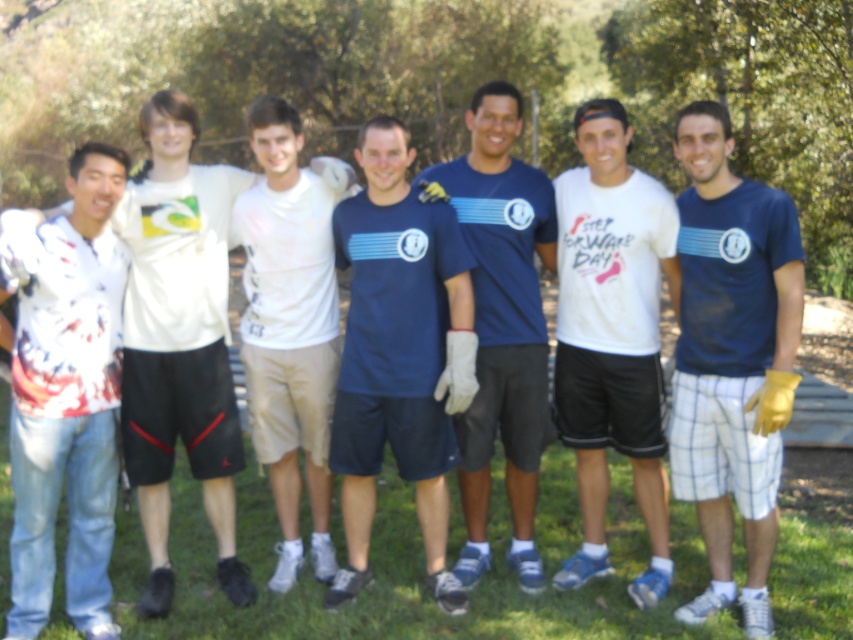
Question: Which of the following is the farthest from the observer?

Choices:
 (A) (589, 497)
 (B) (171, 300)
 (C) (728, 141)

Answer: (A)

Question: Which of the following is the closest to the observer?

Choices:
 (A) [396, 342]
 (B) [535, 557]

Answer: (A)

Question: Does white cotton shirt at left have a lesser width compared to white cotton t-shirt at center?

Choices:
 (A) yes
 (B) no

Answer: (B)

Question: Among these points, which one is nearest to the camera?

Choices:
 (A) (154, 216)
 (B) (422, 364)
 (C) (102, 177)
 (D) (322, 276)

Answer: (C)

Question: Is blue fabric shirt at center smaller than white cotton t-shirt at center?

Choices:
 (A) yes
 (B) no

Answer: (A)

Question: Is white cotton shirt at left thinner than white cotton t-shirt at center?

Choices:
 (A) no
 (B) yes

Answer: (A)